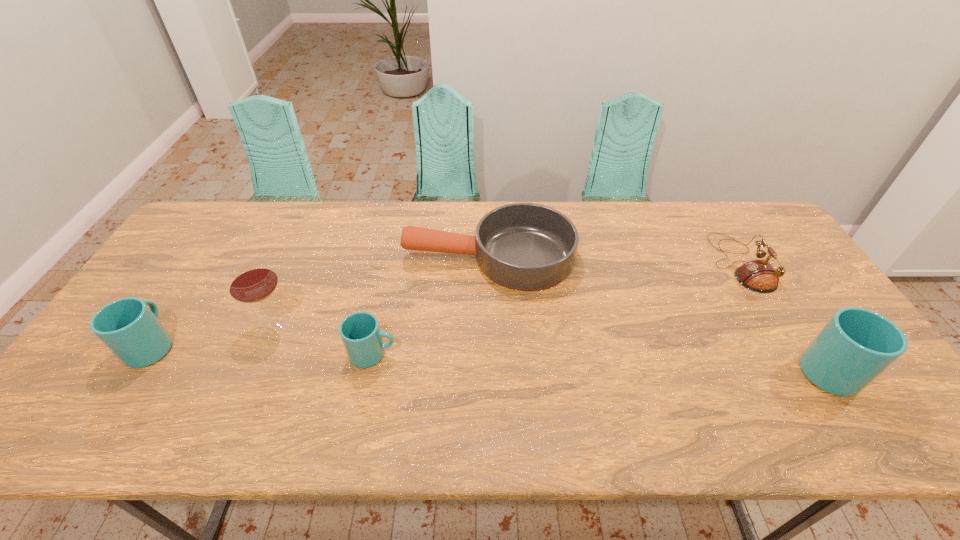
Where is `vacant space in between the second cup from right to left and the fifth shortest object`? The width and height of the screenshot is (960, 540). vacant space in between the second cup from right to left and the fifth shortest object is located at coordinates (606, 364).

Locate which object ranks fourth in proximity to the leftmost object. Please provide its 2D coordinates. Your answer should be formatted as a tuple, i.e. [(x, y)], where the tuple contains the x and y coordinates of a point satisfying the conditions above.

[(759, 276)]

This screenshot has height=540, width=960. I want to click on object that is the second closest to the second tallest object, so click(x=524, y=246).

Identify which cup is located as the nearest to the telephone. Please provide its 2D coordinates. Your answer should be formatted as a tuple, i.e. [(x, y)], where the tuple contains the x and y coordinates of a point satisfying the conditions above.

[(856, 345)]

Find the location of a particular element. cup that is the third closest to the telephone is located at coordinates (128, 327).